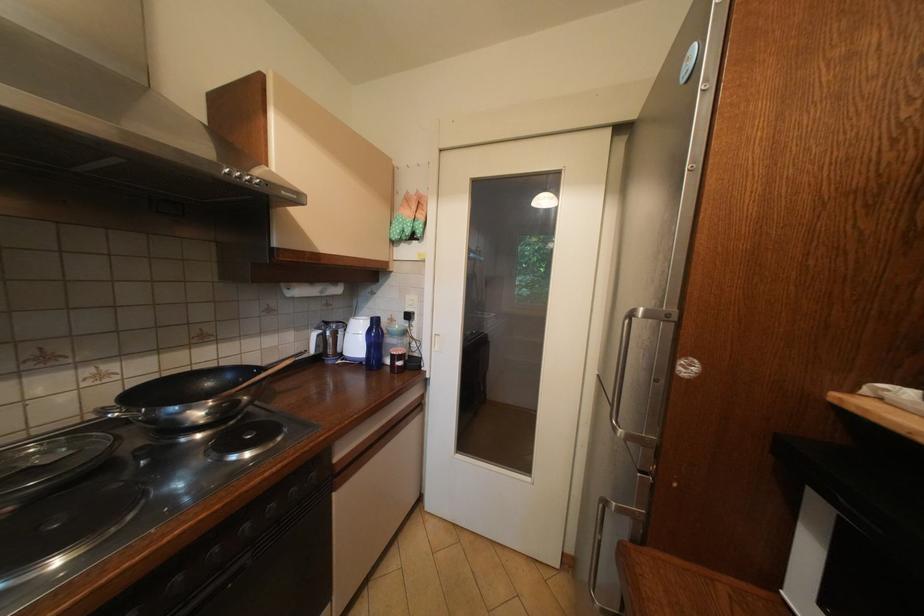
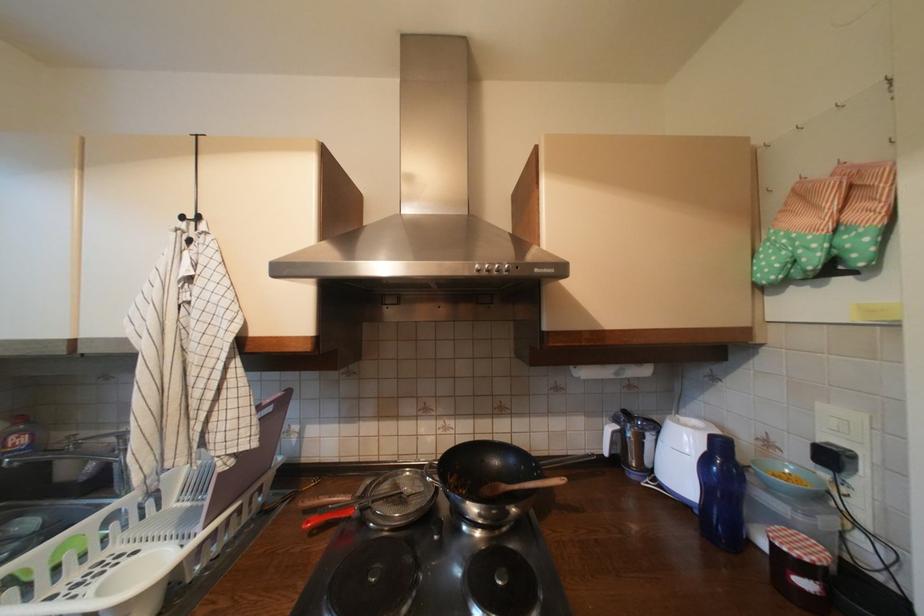
Question: How did the camera likely rotate?

Choices:
 (A) Left
 (B) Right
 (C) Up
 (D) Down

Answer: (A)